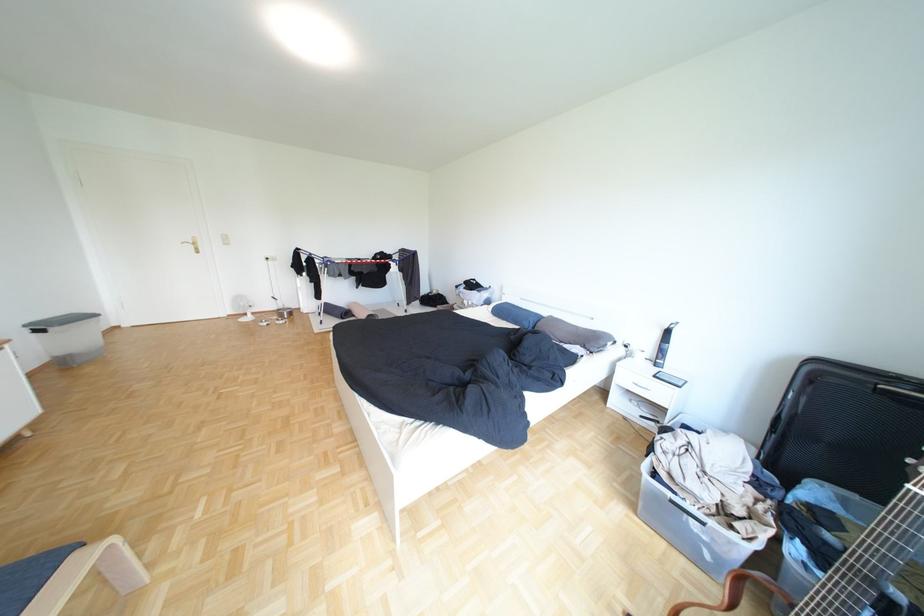
Locate an element on the screen. The width and height of the screenshot is (924, 616). black suitcase handle is located at coordinates (900, 387).